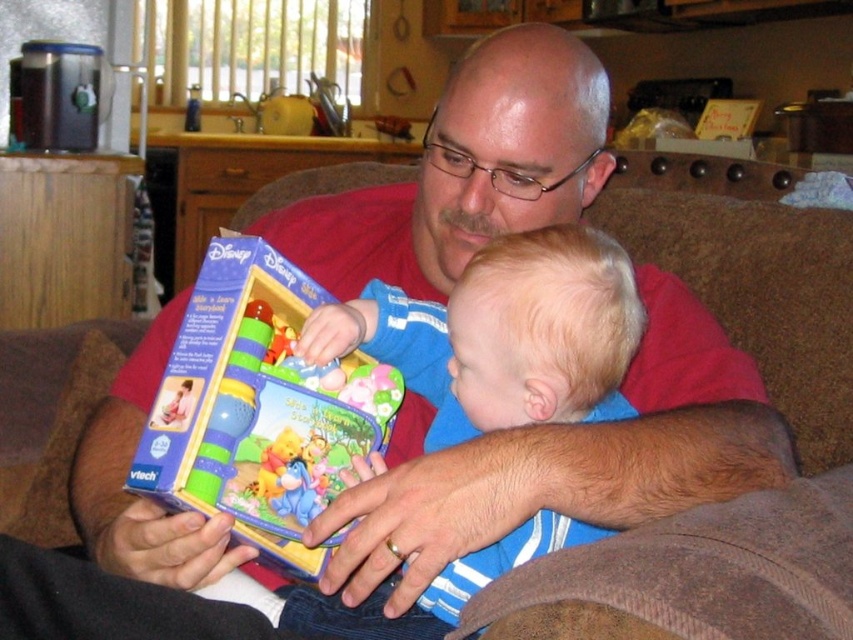
Question: Which object appears closest to the camera in this image?

Choices:
 (A) blue striped shirt at center
 (B) matte plastic toy at center

Answer: (B)

Question: Which object appears farthest from the camera in this image?

Choices:
 (A) blue striped shirt at center
 (B) matte plastic toy at center

Answer: (A)

Question: Which point is farther to the camera?

Choices:
 (A) (221, 442)
 (B) (531, 364)

Answer: (A)

Question: Observing the image, what is the correct spatial positioning of blue striped shirt at center in reference to matte plastic toy at center?

Choices:
 (A) right
 (B) left

Answer: (A)

Question: Can you confirm if blue striped shirt at center is positioned above matte plastic toy at center?

Choices:
 (A) yes
 (B) no

Answer: (B)

Question: Can you confirm if blue striped shirt at center is positioned to the right of matte plastic toy at center?

Choices:
 (A) yes
 (B) no

Answer: (A)